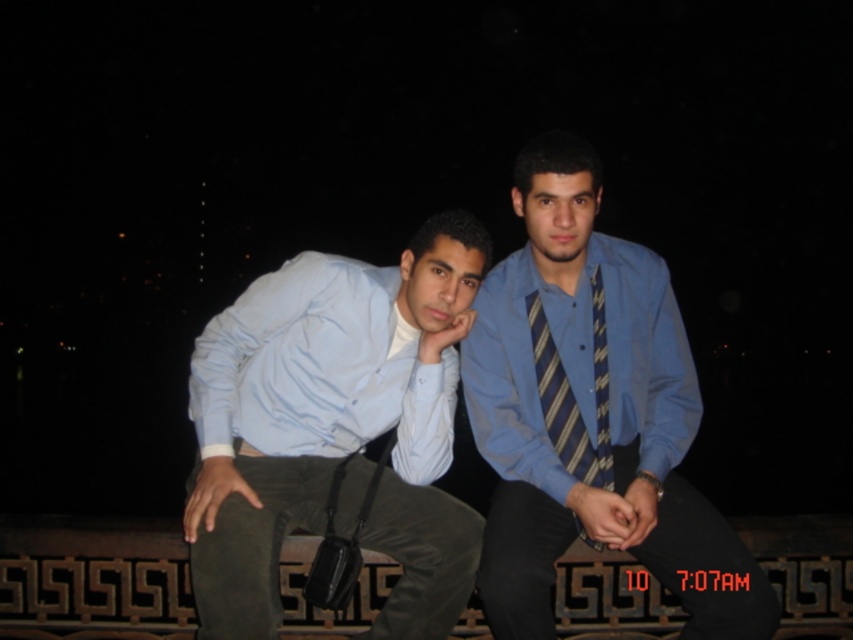
Question: Which point is farther to the camera?

Choices:
 (A) light blue cotton shirt at left
 (B) striped fabric tie at center

Answer: (B)

Question: Does light blue cotton shirt at left have a larger size compared to striped fabric tie at center?

Choices:
 (A) no
 (B) yes

Answer: (B)

Question: Which object is closer to the camera taking this photo?

Choices:
 (A) light blue cotton shirt at left
 (B) blue striped tie at center

Answer: (B)

Question: Can you confirm if matte blue shirt at center is positioned below blue striped tie at center?

Choices:
 (A) no
 (B) yes

Answer: (B)

Question: Which point is closer to the camera?

Choices:
 (A) (575, 449)
 (B) (413, 593)

Answer: (B)

Question: Considering the relative positions of matte blue shirt at center and striped fabric tie at center in the image provided, where is matte blue shirt at center located with respect to striped fabric tie at center?

Choices:
 (A) right
 (B) left

Answer: (B)